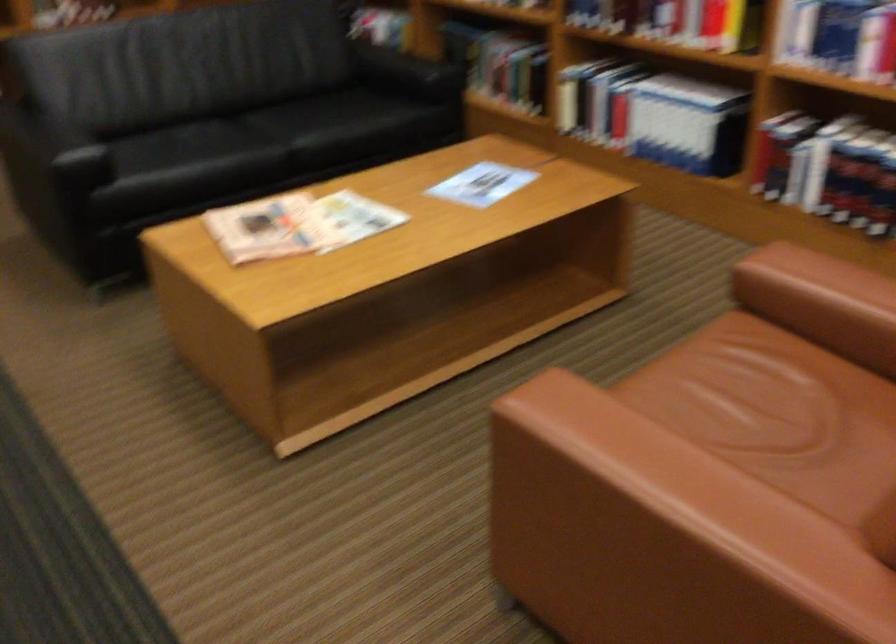
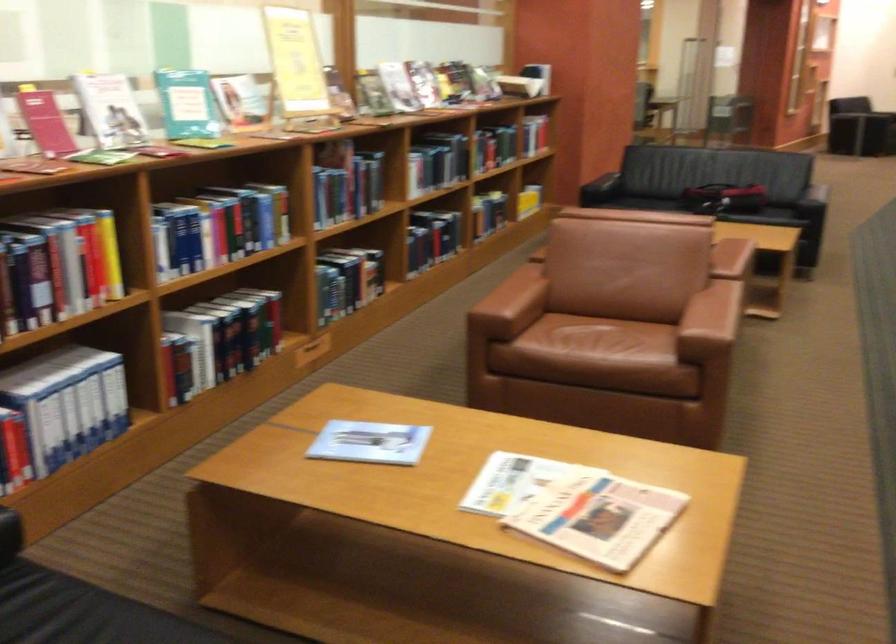
The point at (288,249) is marked in the first image. Where is the corresponding point in the second image?

(574, 507)